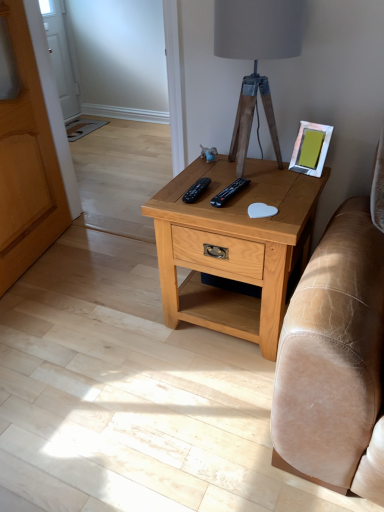
You are a GUI agent. You are given a task and a screenshot of the screen. Output one action in this format:
    pyautogui.click(x=<x>, y=<y>)
    Task: Click on the vacant space behind black plastic remote at center, which is the 1th remote in right-to-left order
    This screenshot has height=512, width=384.
    Given the screenshot: What is the action you would take?
    pyautogui.click(x=229, y=172)